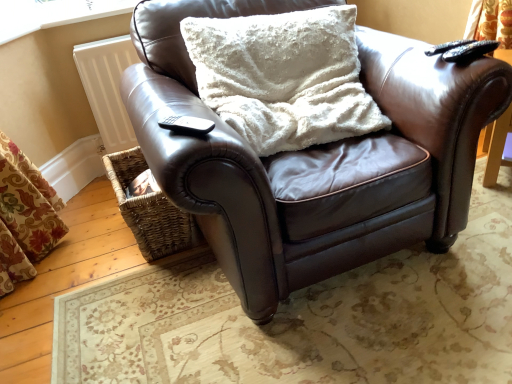
Question: From a real-world perspective, does black plastic remote at lower left, positioned as the 2th remote in top-to-bottom order, stand above black matte remote at upper right, which appears as the second remote when viewed from the front?

Choices:
 (A) no
 (B) yes

Answer: (B)

Question: Can you confirm if black plastic remote at lower left, placed as the 2th remote when sorted from right to left, is bigger than black matte remote at upper right, the 1th remote from the right?

Choices:
 (A) yes
 (B) no

Answer: (B)

Question: From the image's perspective, is black plastic remote at lower left, the first remote positioned from the left, located beneath black matte remote at upper right, which ranks as the 2th remote in left-to-right order?

Choices:
 (A) no
 (B) yes

Answer: (B)

Question: Could you tell me if black plastic remote at lower left, positioned as the 2th remote in top-to-bottom order, is turned towards black matte remote at upper right, which ranks as the 2th remote in left-to-right order?

Choices:
 (A) yes
 (B) no

Answer: (B)

Question: Is black plastic remote at lower left, acting as the 1th remote starting from the bottom, next to black matte remote at upper right, acting as the second remote starting from the bottom?

Choices:
 (A) no
 (B) yes

Answer: (A)

Question: Considering the positions of point (311, 185) and point (64, 16), is point (311, 185) closer or farther from the camera than point (64, 16)?

Choices:
 (A) farther
 (B) closer

Answer: (B)

Question: From the image's perspective, is brown leather chair at center positioned above or below white painted wood at upper left?

Choices:
 (A) above
 (B) below

Answer: (B)

Question: Considering the positions of brown leather chair at center and white painted wood at upper left in the image, is brown leather chair at center wider or thinner than white painted wood at upper left?

Choices:
 (A) wide
 (B) thin

Answer: (A)

Question: Is brown leather chair at center in front of or behind white painted wood at upper left in the image?

Choices:
 (A) front
 (B) behind

Answer: (A)

Question: Is point (330, 173) closer or farther from the camera than point (352, 34)?

Choices:
 (A) farther
 (B) closer

Answer: (B)

Question: Looking at their shapes, would you say brown leather chair at center is wider or thinner than white fluffy pillow at center?

Choices:
 (A) wide
 (B) thin

Answer: (A)

Question: Considering the positions of brown leather chair at center and white fluffy pillow at center in the image, is brown leather chair at center bigger or smaller than white fluffy pillow at center?

Choices:
 (A) big
 (B) small

Answer: (A)

Question: From a real-world perspective, is brown leather chair at center above or below white fluffy pillow at center?

Choices:
 (A) above
 (B) below

Answer: (B)

Question: Considering the positions of brown leather chair at center and black matte remote at upper right, the 1th remote from the right, in the image, is brown leather chair at center wider or thinner than black matte remote at upper right, the 1th remote from the right,?

Choices:
 (A) wide
 (B) thin

Answer: (A)

Question: In the image, is brown leather chair at center positioned in front of or behind black matte remote at upper right, the 1th remote from the right?

Choices:
 (A) front
 (B) behind

Answer: (A)